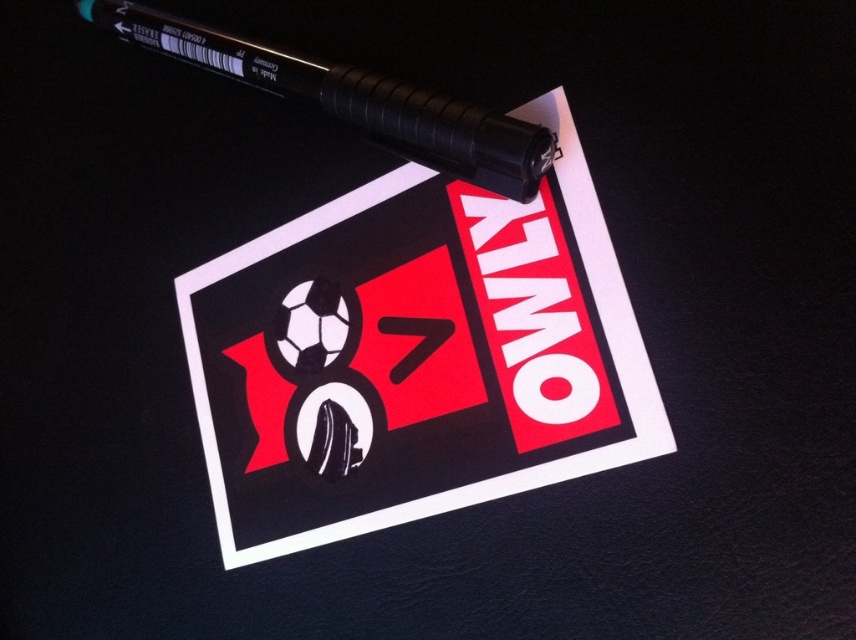
You are trying to write a message on the card. You see the white paper at upper center and the black rubber pen at upper left. Which object should you use to write on the card?

You should use the black rubber pen at upper left to write on the card since it is a pen, while the white paper at upper center is likely the surface where the message would be written, but the question is about the tool to write with.

You are an artist holding a black rubber pen at upper left and want to write on the white paper at upper center. Can you reach the paper without moving the pen?

The white paper at upper center is below the black rubber pen at upper left, so yes, you can reach the paper without moving the pen as it is positioned directly beneath the pen.

You are designing a layout for a poster and need to place the white paper at upper center and the black rubber pen at upper left. Which object is taller?

The white paper at upper center is taller than the black rubber pen at upper left according to the description.